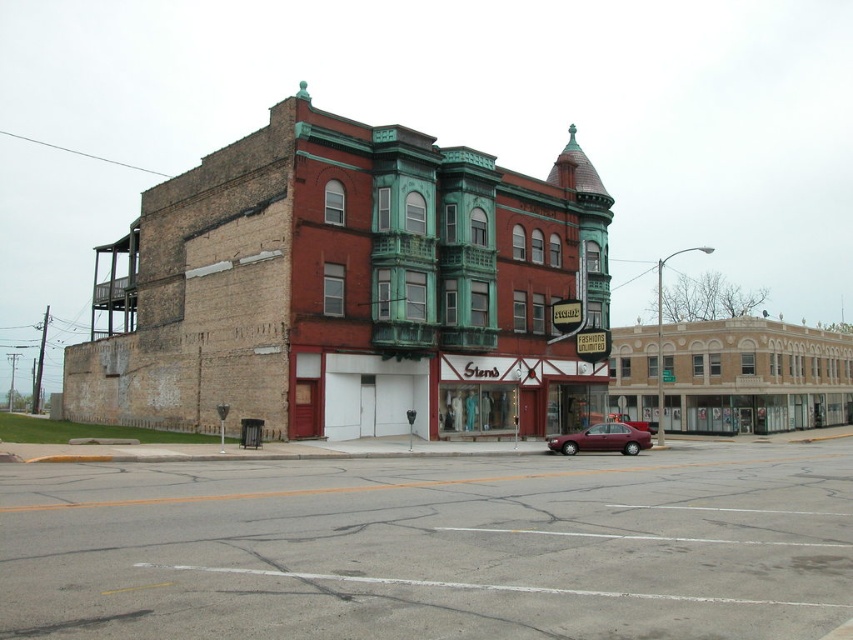
Does asphalt road at center appear over maroon metallic sedan at center?

Yes, asphalt road at center is above maroon metallic sedan at center.

Is asphalt road at center to the right of maroon metallic sedan at center from the viewer's perspective?

Incorrect, asphalt road at center is not on the right side of maroon metallic sedan at center.

Is point (697, 531) more distant than point (621, 445)?

That is False.

At what (x,y) coordinates should I click in order to perform the action: click on asphalt road at center. Please return your answer as a coordinate pair (x, y). The image size is (853, 640). Looking at the image, I should click on (433, 547).